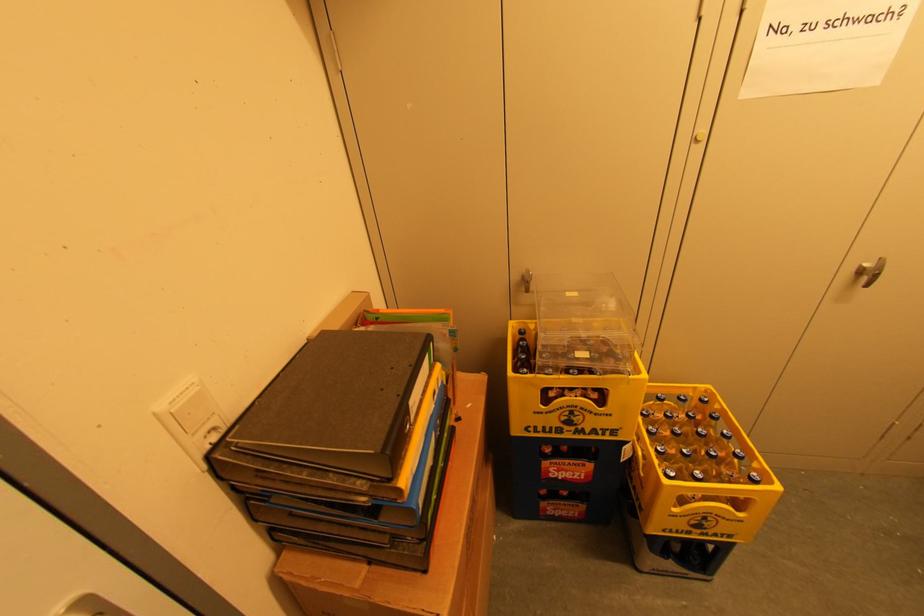
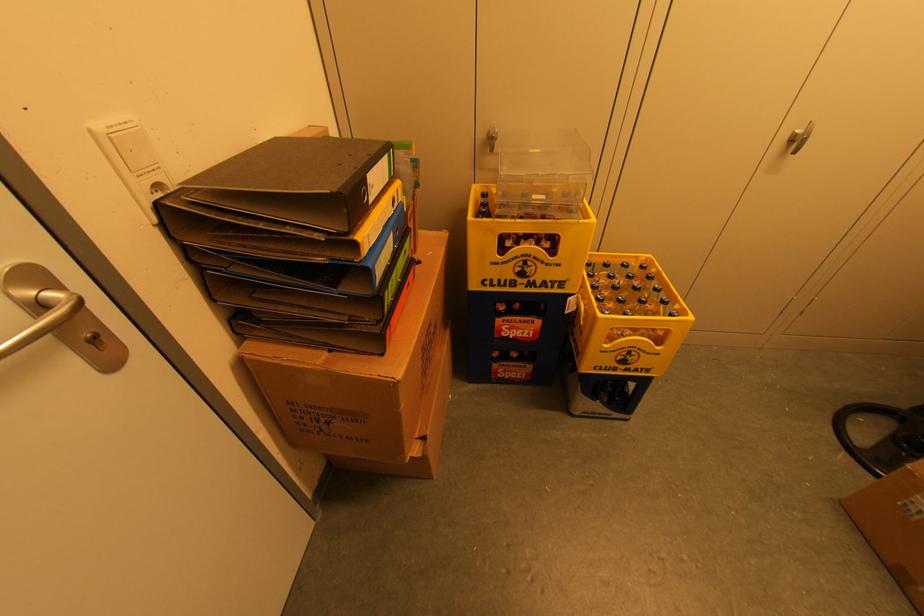
Locate, in the second image, the point that corresponds to (x=718, y=535) in the first image.

(638, 370)